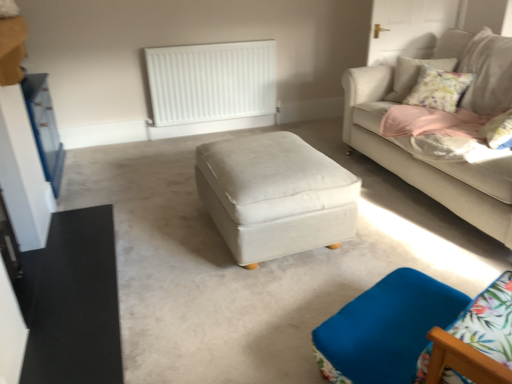
This screenshot has height=384, width=512. What do you see at coordinates (211, 82) in the screenshot?
I see `white matte radiator at upper center` at bounding box center [211, 82].

Where is `satin white ottoman at center`? satin white ottoman at center is located at coordinates (275, 196).

Where is `white matte radiator at upper center`? Image resolution: width=512 pixels, height=384 pixels. white matte radiator at upper center is located at coordinates (211, 82).

Is point (40, 123) behind point (405, 89)?

No, (40, 123) is in front of (405, 89).

From the image's perspective, is blue glossy dresser at left below light beige fabric couch at upper right?

Yes, from the image's perspective, blue glossy dresser at left is below light beige fabric couch at upper right.

Can you confirm if blue glossy dresser at left is thinner than light beige fabric couch at upper right?

Indeed, blue glossy dresser at left has a lesser width compared to light beige fabric couch at upper right.

From a real-world perspective, relative to light beige fabric couch at upper right, is blue glossy dresser at left vertically above or below?

blue glossy dresser at left is situated lower than light beige fabric couch at upper right in the real world.

Is blue fabric swivel chair at lower right spatially inside satin white ottoman at center, or outside of it?

blue fabric swivel chair at lower right lies outside satin white ottoman at center.

Which of these two, blue fabric swivel chair at lower right or satin white ottoman at center, stands shorter?

Standing shorter between the two is blue fabric swivel chair at lower right.

Based on the photo, which is behind, blue fabric swivel chair at lower right or satin white ottoman at center?

satin white ottoman at center is further away from the camera.

Is blue glossy dresser at left surrounded by satin white ottoman at center?

No, satin white ottoman at center does not contain blue glossy dresser at left.

Considering the positions of objects satin white ottoman at center and blue glossy dresser at left in the image provided, who is behind, satin white ottoman at center or blue glossy dresser at left?

blue glossy dresser at left is further away from the camera.

Considering the positions of points (242, 248) and (61, 166), is point (242, 248) closer to camera compared to point (61, 166)?

That is True.

Does white matte radiator at upper center have a greater height compared to blue fabric swivel chair at lower right?

Yes, white matte radiator at upper center is taller than blue fabric swivel chair at lower right.

This screenshot has height=384, width=512. Identify the location of swivel chair below the white matte radiator at upper center (from the image's perspective). (395, 328).

Are white matte radiator at upper center and blue fabric swivel chair at lower right located far from each other?

white matte radiator at upper center is far away from blue fabric swivel chair at lower right.

Who is smaller, white matte radiator at upper center or blue fabric swivel chair at lower right?

With smaller size is blue fabric swivel chair at lower right.

From a real-world perspective, is satin white ottoman at center located beneath white matte radiator at upper center?

Indeed, from a real-world perspective, satin white ottoman at center is positioned beneath white matte radiator at upper center.

Identify the location of table below the white matte radiator at upper center (from a real-world perspective). This screenshot has height=384, width=512. (275, 196).

Which of these two, satin white ottoman at center or white matte radiator at upper center, is bigger?

Bigger between the two is satin white ottoman at center.

Locate an element on the screen. studio couch behind the blue fabric swivel chair at lower right is located at coordinates (425, 160).

Is light beige fabric couch at upper right surrounded by blue fabric swivel chair at lower right?

Definitely not — light beige fabric couch at upper right is not inside blue fabric swivel chair at lower right.

Is blue fabric swivel chair at lower right oriented towards light beige fabric couch at upper right?

No, blue fabric swivel chair at lower right does not turn towards light beige fabric couch at upper right.

Are blue fabric swivel chair at lower right and light beige fabric couch at upper right far apart?

Absolutely, blue fabric swivel chair at lower right is distant from light beige fabric couch at upper right.

Are light beige fabric couch at upper right and blue glossy dresser at left making contact?

light beige fabric couch at upper right and blue glossy dresser at left are clearly separated.

Does light beige fabric couch at upper right have a lesser height compared to blue glossy dresser at left?

Incorrect, the height of light beige fabric couch at upper right does not fall short of that of blue glossy dresser at left.

Which of these two, light beige fabric couch at upper right or blue glossy dresser at left, is smaller?

→ With smaller size is blue glossy dresser at left.

Could you tell me if light beige fabric couch at upper right is turned towards blue glossy dresser at left?

Yes.

Where is `dresser on the left of light beige fabric couch at upper right`? This screenshot has width=512, height=384. dresser on the left of light beige fabric couch at upper right is located at coordinates (44, 128).

Image resolution: width=512 pixels, height=384 pixels. I want to click on table behind the blue fabric swivel chair at lower right, so click(x=275, y=196).

When comparing their distances from blue glossy dresser at left, does light beige fabric couch at upper right or blue fabric swivel chair at lower right seem further?

blue fabric swivel chair at lower right lies further to blue glossy dresser at left than the other object.

Which object lies nearer to the anchor point blue fabric swivel chair at lower right, blue glossy dresser at left or white matte radiator at upper center?

A: Based on the image, blue glossy dresser at left appears to be nearer to blue fabric swivel chair at lower right.

When comparing their distances from blue fabric swivel chair at lower right, does white matte radiator at upper center or blue glossy dresser at left seem closer?

blue glossy dresser at left is positioned closer to the anchor blue fabric swivel chair at lower right.

From the image, which object appears to be nearer to blue glossy dresser at left, white matte radiator at upper center or light beige fabric couch at upper right?

white matte radiator at upper center is closer to blue glossy dresser at left.

Based on their spatial positions, is light beige fabric couch at upper right or blue fabric swivel chair at lower right further from satin white ottoman at center?

light beige fabric couch at upper right lies further to satin white ottoman at center than the other object.

From the image, which object appears to be farther from blue glossy dresser at left, blue fabric swivel chair at lower right or satin white ottoman at center?

blue fabric swivel chair at lower right.

From the image, which object appears to be farther from light beige fabric couch at upper right, blue glossy dresser at left or white matte radiator at upper center?

blue glossy dresser at left is further to light beige fabric couch at upper right.

From the image, which object appears to be farther from satin white ottoman at center, blue fabric swivel chair at lower right or blue glossy dresser at left?

Based on the image, blue glossy dresser at left appears to be further to satin white ottoman at center.

The height and width of the screenshot is (384, 512). Identify the location of swivel chair between satin white ottoman at center and light beige fabric couch at upper right from left to right. (395, 328).

Where is `table positioned between blue fabric swivel chair at lower right and white matte radiator at upper center from near to far`? This screenshot has width=512, height=384. table positioned between blue fabric swivel chair at lower right and white matte radiator at upper center from near to far is located at coordinates (275, 196).

The height and width of the screenshot is (384, 512). What are the coordinates of `table between light beige fabric couch at upper right and white matte radiator at upper center along the z-axis` in the screenshot? It's located at (275, 196).

Where is `table between blue glossy dresser at left and light beige fabric couch at upper right from left to right`? This screenshot has width=512, height=384. table between blue glossy dresser at left and light beige fabric couch at upper right from left to right is located at coordinates (275, 196).